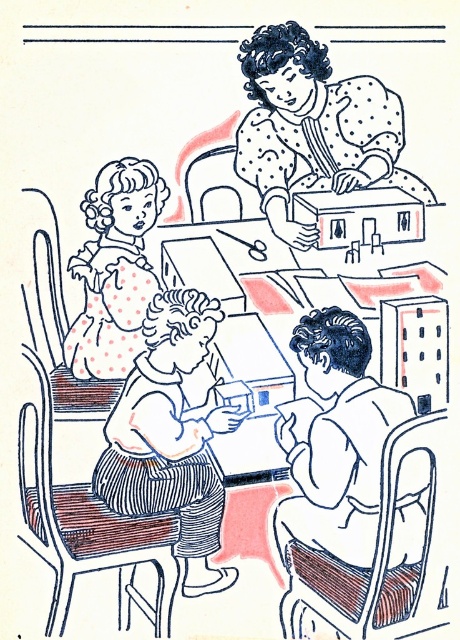
You are a teacher in a classroom and need to place a small toy between the striped fabric skirt at center and the polka dot fabric doll at upper left. The toy is 7 centimeters long. Will it fit without overlapping either object?

The striped fabric skirt at center is 6.50 centimeters away from the polka dot fabric doll at upper left. Since the toy is 7 centimeters long, it will not fit between them without overlapping because the distance is shorter than the toy.

You are a tailor looking at this vintage classroom illustration. You need to determine which fabric item has a taller height between the striped fabric skirt at center and the polka dot fabric doll at upper left. Which one is taller?

The striped fabric skirt at center has a greater height compared to the polka dot fabric doll at upper left, so the striped fabric skirt at center is taller.